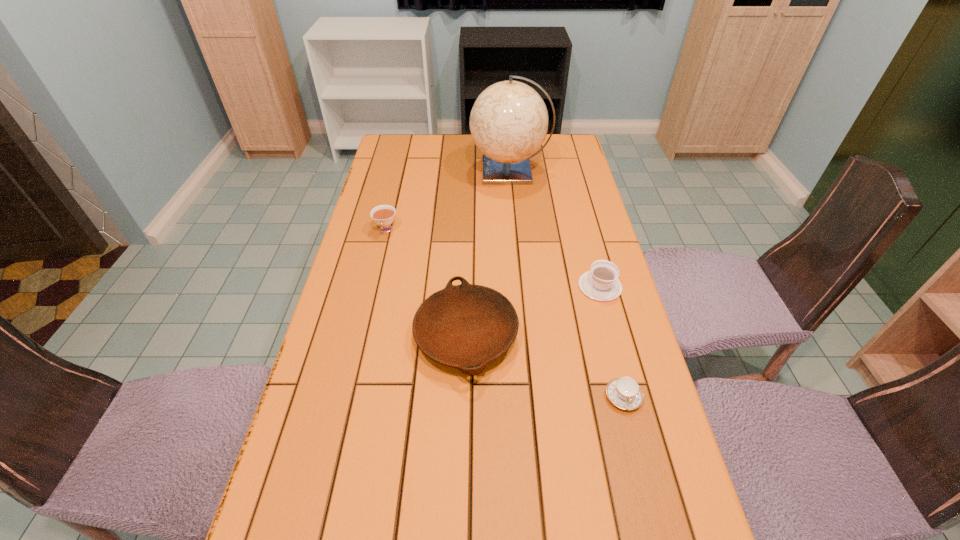
Where is `the tallest object`? The width and height of the screenshot is (960, 540). the tallest object is located at coordinates (509, 120).

I want to click on globe, so click(x=509, y=120).

In order to click on plate in this screenshot , I will do `click(466, 326)`.

I want to click on the second farthest object, so click(x=383, y=215).

The width and height of the screenshot is (960, 540). What are the coordinates of `the leftmost teacup` in the screenshot? It's located at (383, 215).

Where is `the second farthest teacup`? the second farthest teacup is located at coordinates (601, 283).

You are a GUI agent. You are given a task and a screenshot of the screen. Output one action in this format:
    pyautogui.click(x=<x>, y=<y>)
    Task: Click on the nearest teacup
    The width and height of the screenshot is (960, 540).
    Given the screenshot: What is the action you would take?
    pyautogui.click(x=624, y=392)

Find the location of a particular element. the shortest object is located at coordinates (624, 392).

Find the location of a particular element. Image resolution: width=960 pixels, height=540 pixels. vacant point located 0.060m on the surface of the farthest object showing Europe and Africa is located at coordinates (454, 171).

The height and width of the screenshot is (540, 960). Identify the location of free space located 0.200m on the surface of the farthest object showing Europe and Africa. (416, 171).